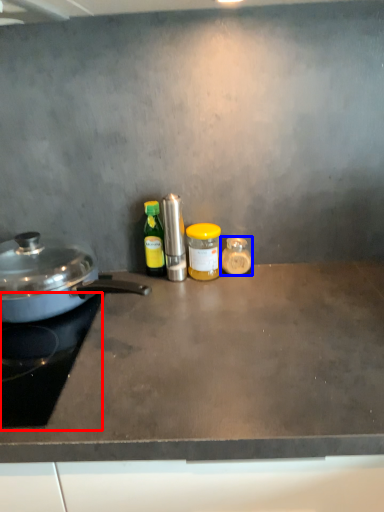
Question: Which object is further to the camera taking this photo, gas stove (highlighted by a red box) or kitchen appliance (highlighted by a blue box)?

Choices:
 (A) gas stove
 (B) kitchen appliance

Answer: (B)